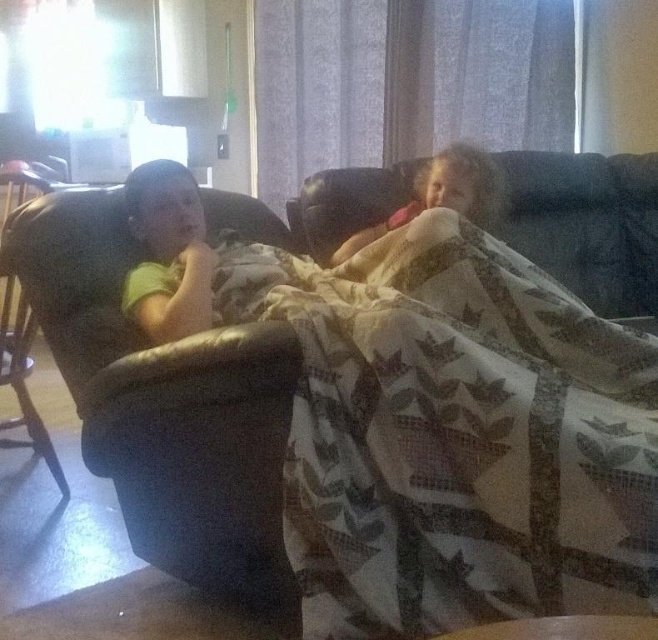
Who is positioned more to the left, printed fabric blanket at center or dark fabric couch at upper right?

printed fabric blanket at center is more to the left.

Is point (594, 596) behind point (574, 257)?

No.

At what (x,y) coordinates should I click in order to perform the action: click on printed fabric blanket at center. Please return your answer as a coordinate pair (x, y). This screenshot has height=640, width=658. Looking at the image, I should click on (459, 432).

Is point (588, 168) more distant than point (130, 208)?

Yes, it is behind point (130, 208).

Between point (353, 198) and point (178, 323), which one is positioned in front?

Point (178, 323)

Image resolution: width=658 pixels, height=640 pixels. In order to click on dark fabric couch at upper right in this screenshot , I will do `click(588, 224)`.

Can you confirm if matte green shirt at left is smaller than soft pink blanket at center?

Indeed, matte green shirt at left has a smaller size compared to soft pink blanket at center.

Image resolution: width=658 pixels, height=640 pixels. What do you see at coordinates (168, 253) in the screenshot? I see `matte green shirt at left` at bounding box center [168, 253].

Locate an element on the screen. The width and height of the screenshot is (658, 640). matte green shirt at left is located at coordinates (168, 253).